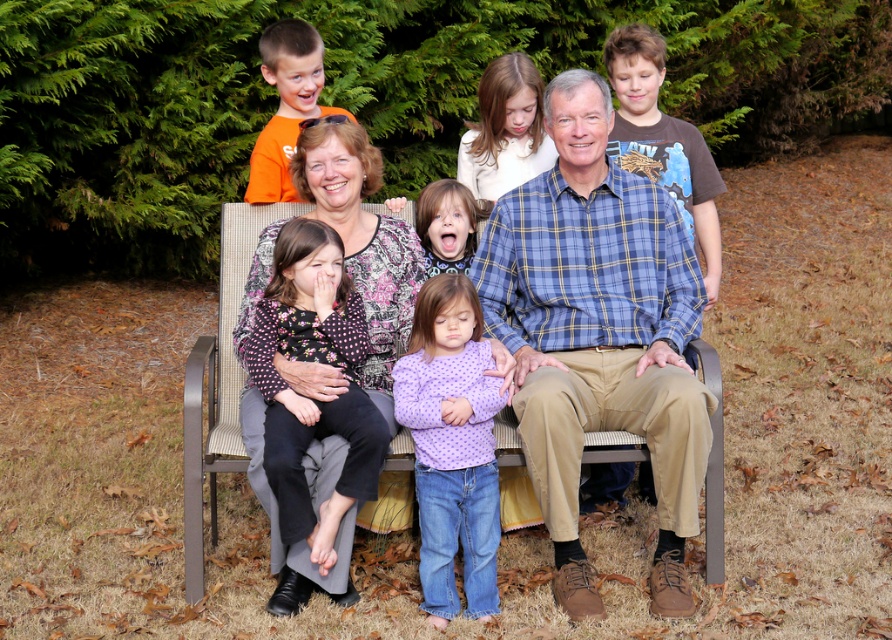
Question: Based on their relative distances, which object is farther from the purple polka dot shirt at center?

Choices:
 (A) white matte shirt at upper center
 (B) floral-patterned shirt at center
 (C) orange cotton shirt at upper left

Answer: (C)

Question: Is matte plaid shirt at center smaller than floral-patterned shirt at center?

Choices:
 (A) yes
 (B) no

Answer: (B)

Question: Where is floral-patterned shirt at center located in relation to matte purple shirt at center in the image?

Choices:
 (A) left
 (B) right

Answer: (A)

Question: Which object is closer to the camera taking this photo?

Choices:
 (A) purple polka dot shirt at center
 (B) orange cotton shirt at upper left
 (C) white matte shirt at upper center

Answer: (A)

Question: Does purple polka dot shirt at center have a greater width compared to orange cotton shirt at upper left?

Choices:
 (A) yes
 (B) no

Answer: (B)

Question: Which of the following is the farthest from the observer?

Choices:
 (A) (254, 189)
 (B) (591, 161)
 (C) (446, 442)

Answer: (A)